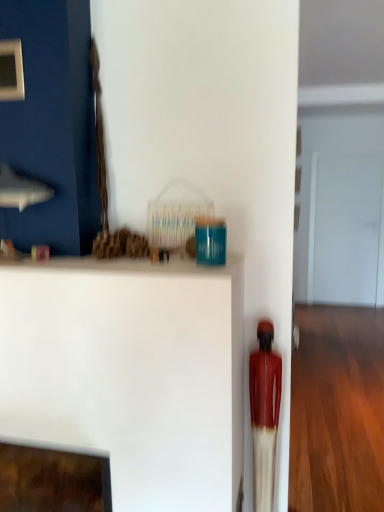
Question: In terms of size, does white matte shelf at center appear bigger or smaller than matte red statue at right?

Choices:
 (A) small
 (B) big

Answer: (B)

Question: Is point (160, 290) positioned closer to the camera than point (248, 360)?

Choices:
 (A) closer
 (B) farther

Answer: (A)

Question: Estimate the real-world distances between objects in this image. Which object is closer to the white matte shelf at center?

Choices:
 (A) transparent glass door at center
 (B) matte red statue at right

Answer: (B)

Question: Considering the real-world distances, which object is closest to the transparent glass door at center?

Choices:
 (A) white matte shelf at center
 (B) matte red statue at right

Answer: (B)